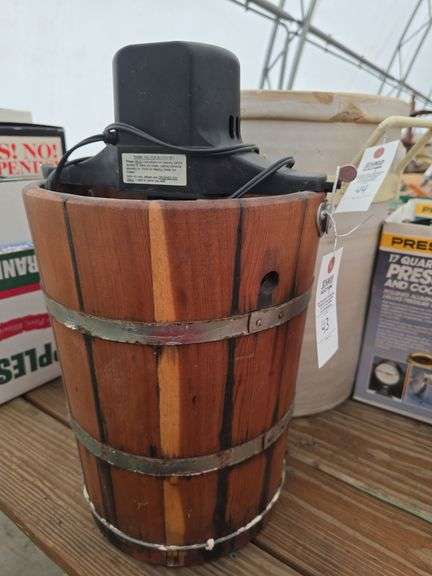
This screenshot has height=576, width=432. I want to click on wood planks, so click(x=362, y=530), click(x=392, y=478), click(x=254, y=560).